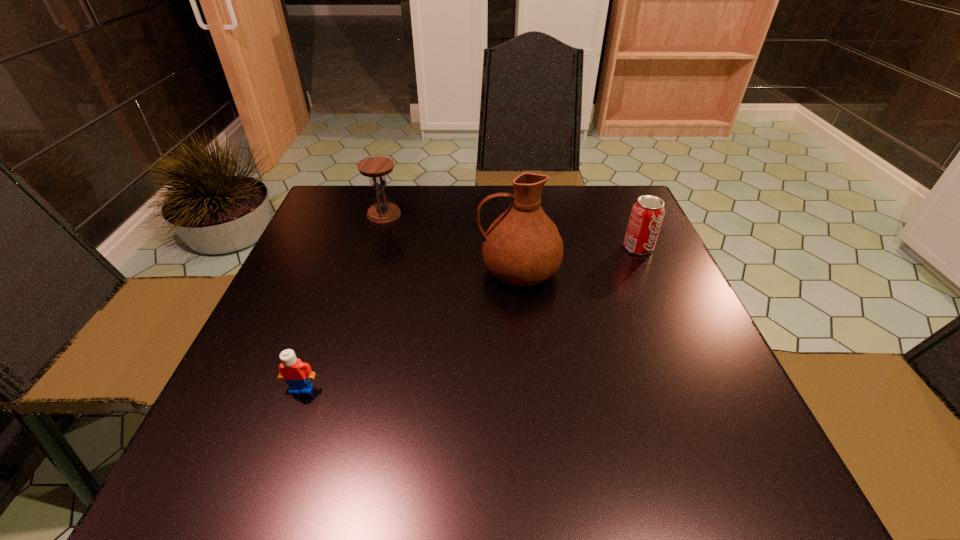
Locate an element on the screen. Image resolution: width=960 pixels, height=540 pixels. the third object from left to right is located at coordinates (522, 247).

Where is `the tallest object`? the tallest object is located at coordinates (522, 247).

What are the coordinates of `hourglass` in the screenshot? It's located at (382, 212).

Locate an element on the screen. This screenshot has width=960, height=540. the rightmost object is located at coordinates (647, 213).

At what (x,y) coordinates should I click in order to perform the action: click on the nearest object. Please return your answer as a coordinate pair (x, y). The height and width of the screenshot is (540, 960). Looking at the image, I should click on (297, 374).

At what (x,y) coordinates should I click in order to perform the action: click on Lego. Please return your answer as a coordinate pair (x, y). This screenshot has width=960, height=540. Looking at the image, I should click on (297, 374).

At what (x,y) coordinates should I click in order to perform the action: click on vacant space located on the side of the pitcher with the handle. Please return your answer as a coordinate pair (x, y). The image size is (960, 540). Looking at the image, I should click on (302, 271).

This screenshot has height=540, width=960. I want to click on vacant position located on the side of the pitcher with the handle, so click(x=359, y=271).

Image resolution: width=960 pixels, height=540 pixels. I want to click on vacant point located 0.370m on the side of the pitcher with the handle, so click(316, 271).

Where is `vacant space located on the front of the hourglass`? The width and height of the screenshot is (960, 540). vacant space located on the front of the hourglass is located at coordinates (351, 325).